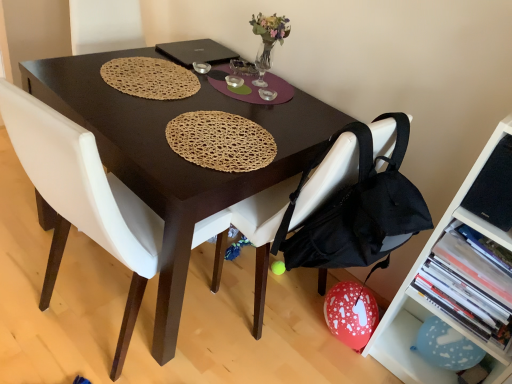
This screenshot has height=384, width=512. Find the location of `free location to the right of metallic silver bowl at center`. free location to the right of metallic silver bowl at center is located at coordinates (229, 77).